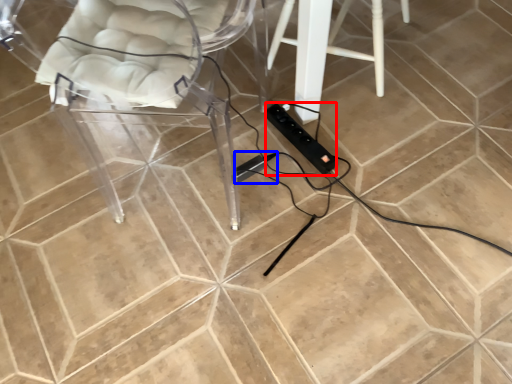
Question: Among these objects, which one is farthest to the camera, extension cord (highlighted by a red box) or extension cord (highlighted by a blue box)?

Choices:
 (A) extension cord
 (B) extension cord

Answer: (B)